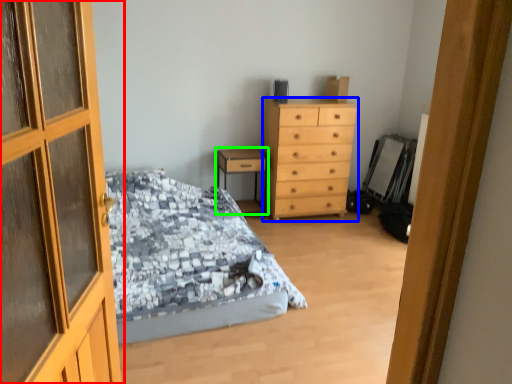
Question: Based on their relative distances, which object is nearer to door (highlighted by a red box)? Choose from chest of drawers (highlighted by a blue box) and nightstand (highlighted by a green box).

Choices:
 (A) chest of drawers
 (B) nightstand

Answer: (A)